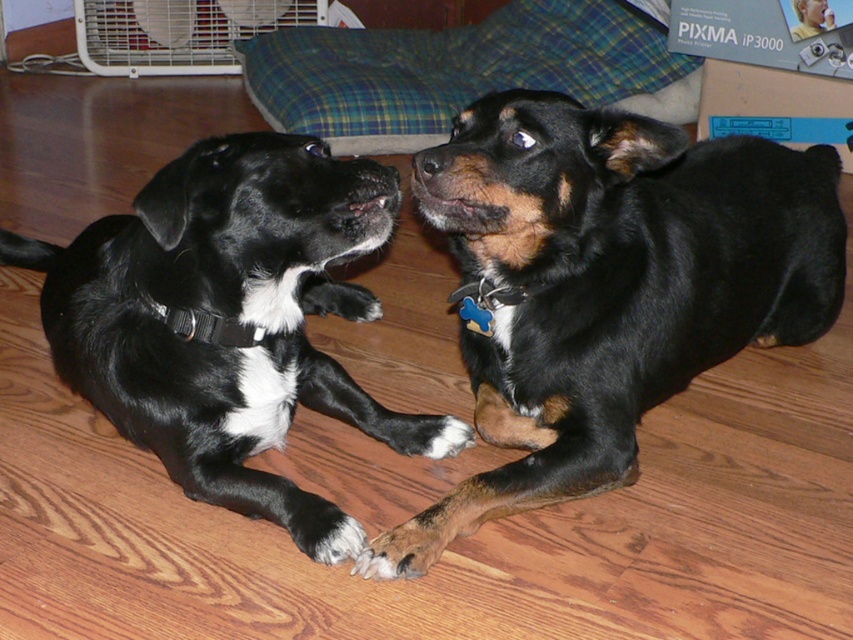
You are a photographer trying to capture a photo of both the black shiny dog at center and the black matte dog at center. Since you want to ensure both are visible in the frame, can you determine which dog is on the left side?

The black matte dog at center is on the left side because the black shiny dog at center is positioned on the right side of it.

You are standing in the room and want to pick up an object from the floor. You can reach objects closer to you. Which point should you try to reach first, point (633, 176) or point (440, 528)?

Point (440, 528) is closer to you than point (633, 176), so you should try to reach point (440, 528) first.